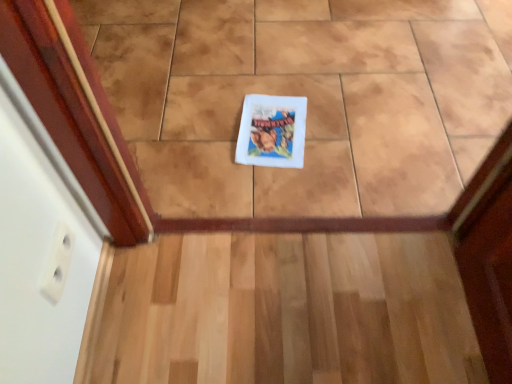
This screenshot has width=512, height=384. I want to click on free space above white matte book cover at center (from a real-world perspective), so click(272, 117).